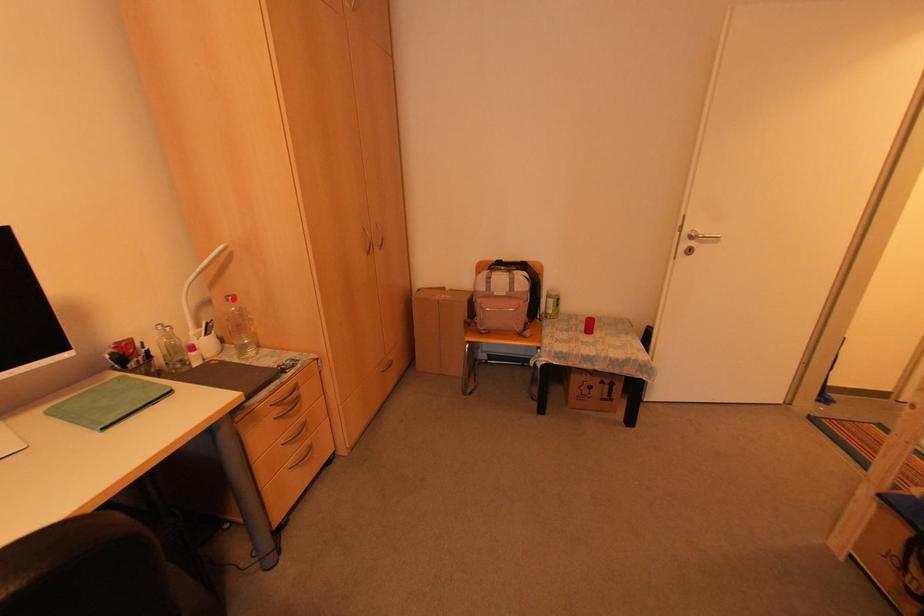
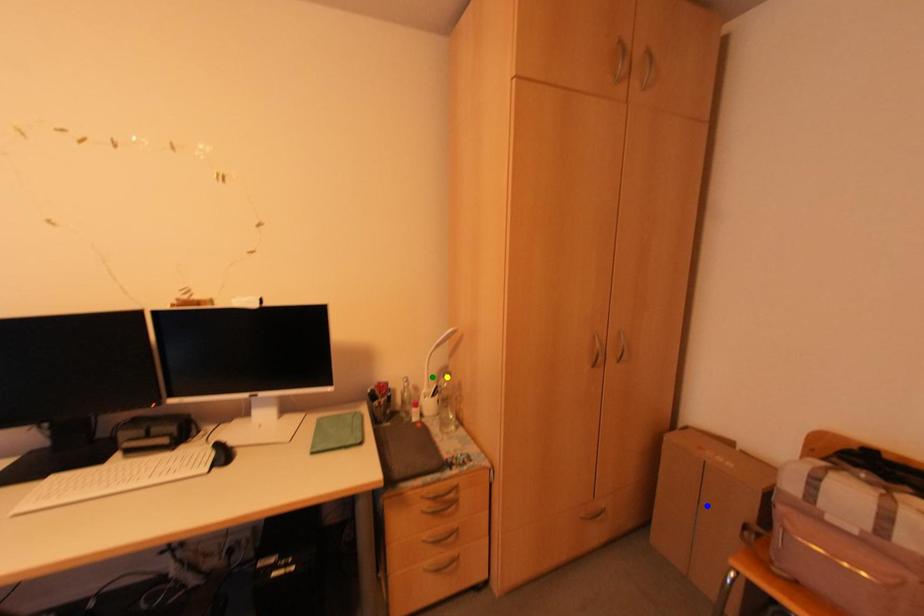
Question: I am providing you with two images of the same scene from different viewpoints. A red point is marked on the first image. You are given multiple points on the second image. Which point in image 2 represents the same 3d spot as the red point in image 1?

Choices:
 (A) yellow point
 (B) blue point
 (C) green point

Answer: (A)